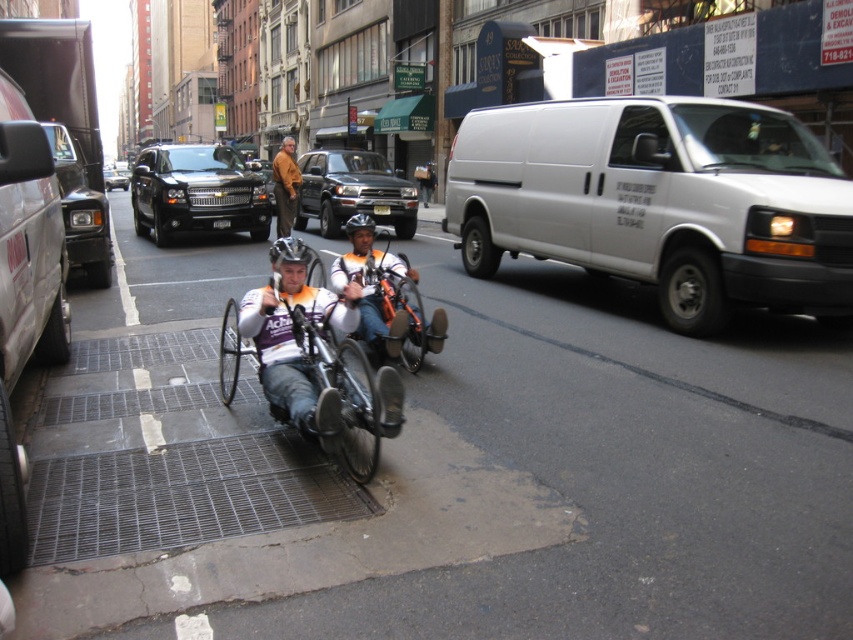
Is white matte van at center further to the viewer compared to brown leather jacket at center?

No, it is in front of brown leather jacket at center.

At what (x,y) coordinates should I click in order to perform the action: click on white matte van at center. Please return your answer as a coordinate pair (x, y). The width and height of the screenshot is (853, 640). Looking at the image, I should click on (659, 202).

Describe the element at coordinates (659, 202) in the screenshot. I see `white matte van at center` at that location.

Find the location of a particular element. Image resolution: width=853 pixels, height=640 pixels. white matte van at center is located at coordinates (659, 202).

Is the position of matte black tricycle at center more distant than that of brown leather jacket at center?

No, it is not.

Between point (224, 323) and point (288, 198), which one is positioned behind?

Positioned behind is point (288, 198).

Is point (281, 278) positioned before point (279, 195)?

Yes, point (281, 278) is closer to viewer.

Locate an element on the screen. This screenshot has height=640, width=853. matte black tricycle at center is located at coordinates [311, 362].

Is point (712, 230) positioned behind point (115, 186)?

No, it is not.

Find the location of a particular element. The width and height of the screenshot is (853, 640). white matte van at center is located at coordinates (659, 202).

This screenshot has width=853, height=640. I want to click on white matte van at center, so click(x=659, y=202).

Identify the location of white matte van at center. (659, 202).